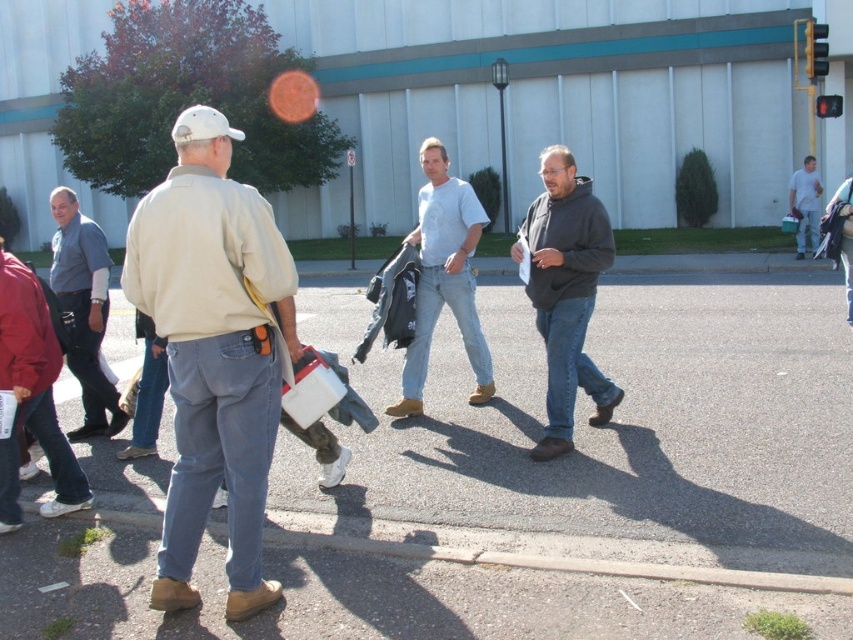
Measure the distance between dark gray hoodie at center and camera.

dark gray hoodie at center and camera are 5.52 meters apart from each other.

Does dark gray hoodie at center have a greater width compared to blue denim jeans at left?

No.

Is point (575, 266) farther from viewer compared to point (70, 209)?

No, it is in front of (70, 209).

Identify the location of dark gray hoodie at center. (566, 292).

Who is positioned more to the left, beige fabric jacket at left or light gray t-shirt at center?

Positioned to the left is beige fabric jacket at left.

Between point (228, 269) and point (439, 275), which one is positioned behind?

Point (439, 275)

Between point (184, 445) and point (466, 348), which one is positioned behind?

The point (466, 348) is more distant.

Locate an element on the screen. This screenshot has width=853, height=640. beige fabric jacket at left is located at coordinates (213, 352).

Is dark gray hoodie at center to the right of light blue shirt at center from the viewer's perspective?

No, dark gray hoodie at center is not to the right of light blue shirt at center.

Does dark gray hoodie at center appear over light blue shirt at center?

No.

This screenshot has width=853, height=640. Describe the element at coordinates (566, 292) in the screenshot. I see `dark gray hoodie at center` at that location.

Locate an element on the screen. dark gray hoodie at center is located at coordinates (566, 292).